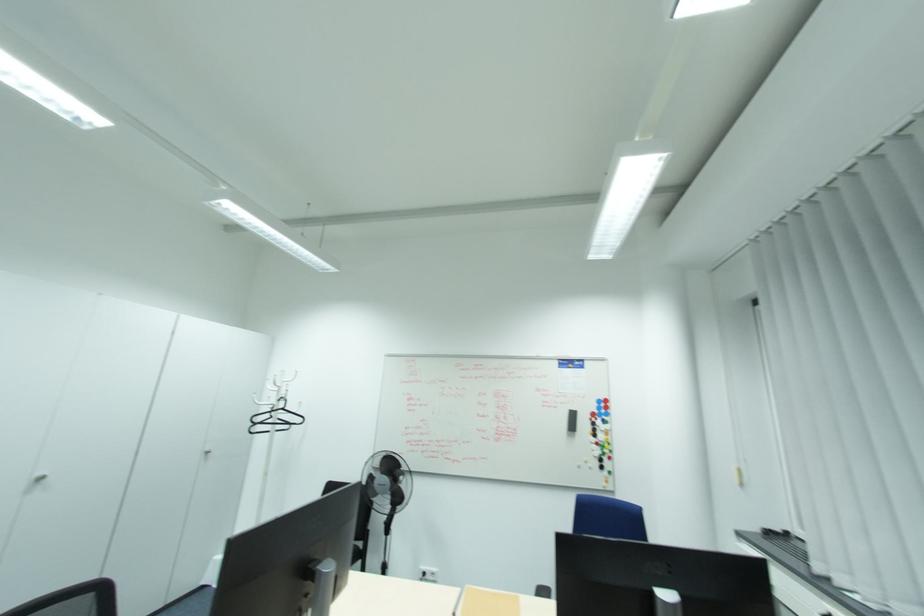
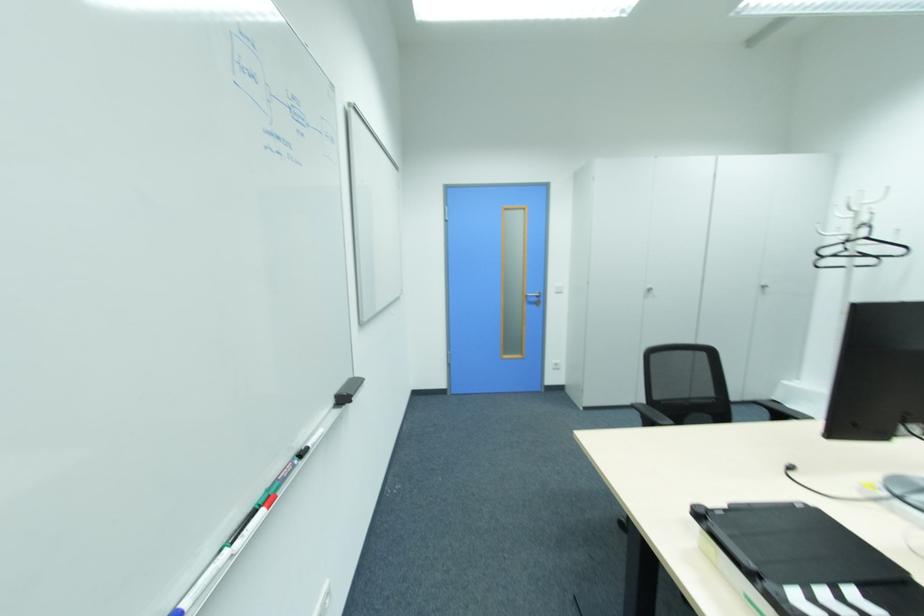
Locate, in the second image, the point that corresponds to the point at 42,475 in the first image.

(650, 288)